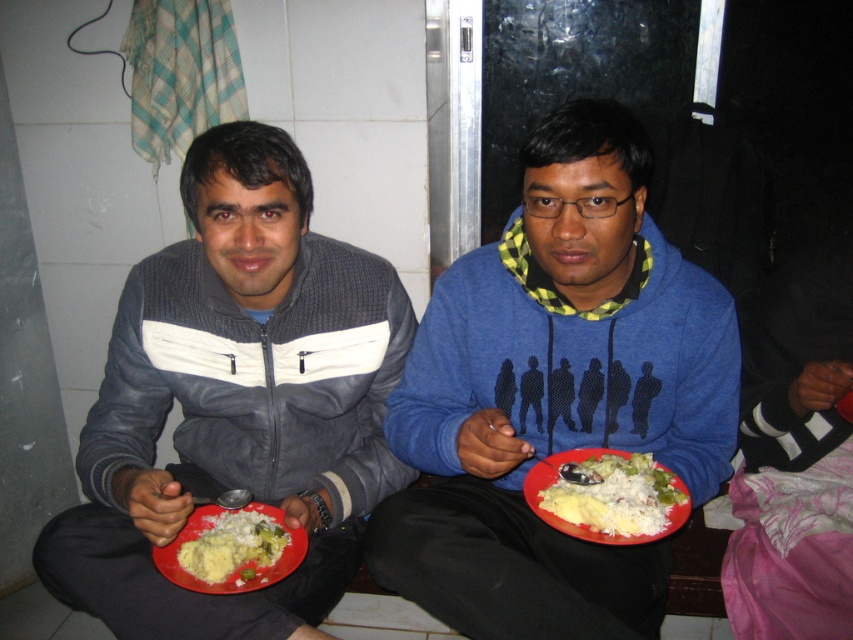
Where is the blue fleece hoodie at center located in the image?

The blue fleece hoodie at center is located at point 0.617 on the x axis and 0.652 on the y axis.

Please provide the exact coordinates of the blue fleece hoodie at center in the image. The coordinate system has its origin at the bottom left corner of the image, with the x and y axes increasing to the right and up respectively. The coordinates are normalized between 0 and 1.

The blue fleece hoodie at center is located at coordinates point (x=555, y=394).

You are a delivery robot that needs to deliver a package to the person wearing the blue fleece hoodie at center without disturbing the person in the matte gray jacket at left. Given that the robot requires 15 inches of space to move safely, can it navigate between them?

The distance between the blue fleece hoodie at center and the matte gray jacket at left is 12.00 inches, which is less than the required 15 inches of space for the robot to move safely. Therefore, the robot cannot navigate between them without potentially disturbing the person in the matte gray jacket at left.